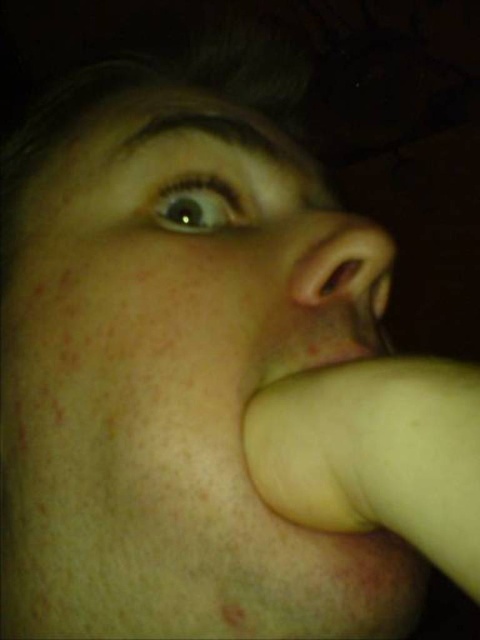
Question: Which object is closer to the camera taking this photo?

Choices:
 (A) smooth yellow hand at lower right
 (B) smooth yellowish flesh at lower center
 (C) brown matte freckle at lower center
 (D) smooth skin nose at center

Answer: (A)

Question: Does smooth yellowish flesh at lower center come behind brown matte freckle at lower center?

Choices:
 (A) no
 (B) yes

Answer: (B)

Question: Does smooth skin nose at center have a lesser width compared to smooth yellowish flesh at lower center?

Choices:
 (A) yes
 (B) no

Answer: (B)

Question: Does smooth yellowish flesh at lower center have a smaller size compared to brown matte freckle at lower center?

Choices:
 (A) yes
 (B) no

Answer: (B)

Question: Which object appears closest to the camera in this image?

Choices:
 (A) smooth skin nose at center
 (B) brown matte freckle at lower center
 (C) smooth yellow hand at lower right

Answer: (C)

Question: Which point is farther to the camera?

Choices:
 (A) (224, 608)
 (B) (322, 252)
 (C) (317, 344)

Answer: (B)